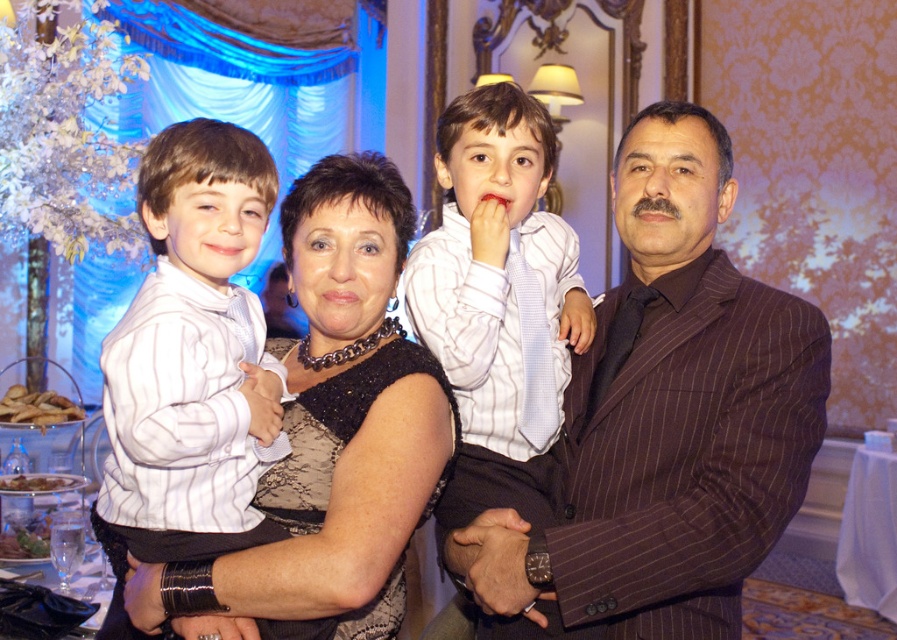
Between brown pinstripe suit at center and white striped shirt at center, which one appears on the left side from the viewer's perspective?

white striped shirt at center

You are a GUI agent. You are given a task and a screenshot of the screen. Output one action in this format:
    pyautogui.click(x=<x>, y=<y>)
    Task: Click on the brown pinstripe suit at center
    This screenshot has width=897, height=640.
    Given the screenshot: What is the action you would take?
    pyautogui.click(x=666, y=419)

Who is shorter, brown pinstripe suit at center or white striped shirt at left?

Standing shorter between the two is white striped shirt at left.

Does brown pinstripe suit at center have a smaller size compared to white striped shirt at left?

Actually, brown pinstripe suit at center might be larger than white striped shirt at left.

Is point (598, 529) positioned after point (164, 435)?

Yes, point (598, 529) is farther from viewer.

Locate an element on the screen. This screenshot has width=897, height=640. brown pinstripe suit at center is located at coordinates (666, 419).

From the picture: Is the position of brown pinstripe suit at center less distant than that of black lace dress at center?

No.

Can you confirm if brown pinstripe suit at center is thinner than black lace dress at center?

In fact, brown pinstripe suit at center might be wider than black lace dress at center.

The height and width of the screenshot is (640, 897). I want to click on brown pinstripe suit at center, so (x=666, y=419).